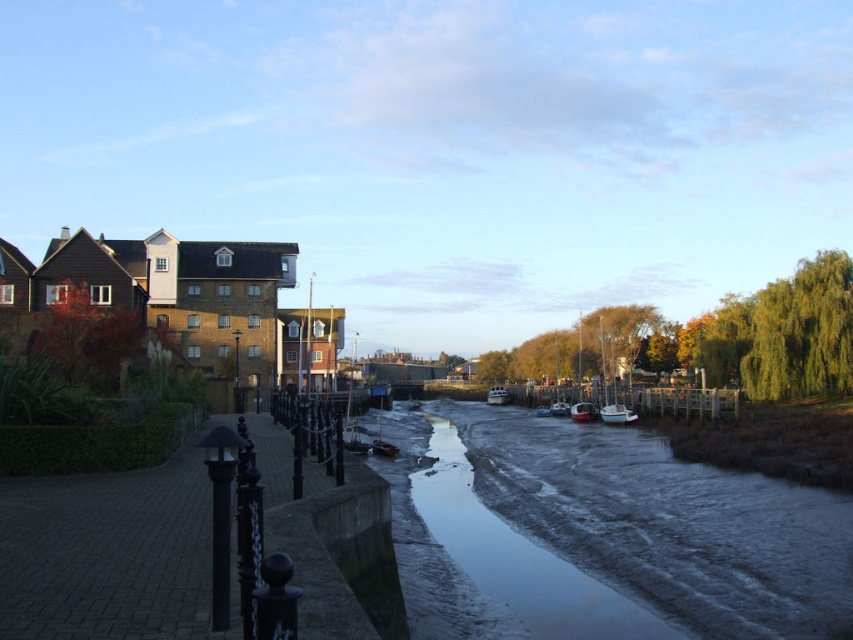
Does white matte boat at center have a greater height compared to white glossy boat at center?

In fact, white matte boat at center may be shorter than white glossy boat at center.

Does white matte boat at center have a smaller size compared to white glossy boat at center?

Correct, white matte boat at center occupies less space than white glossy boat at center.

Is point (602, 417) more distant than point (486, 397)?

No, it is not.

At what (x,y) coordinates should I click in order to perform the action: click on white matte boat at center. Please return your answer as a coordinate pair (x, y). Looking at the image, I should click on (618, 413).

Which is in front, point (380, 440) or point (566, 412)?

Point (380, 440) is in front.

Can you confirm if wooden boat at center is positioned to the right of blue glossy boat at center?

In fact, wooden boat at center is to the left of blue glossy boat at center.

Identify the location of wooden boat at center. This screenshot has height=640, width=853. (383, 449).

Between point (602, 419) and point (564, 406), which one is positioned behind?

The point (564, 406) is more distant.

Where is `white matte boat at center`? white matte boat at center is located at coordinates (618, 413).